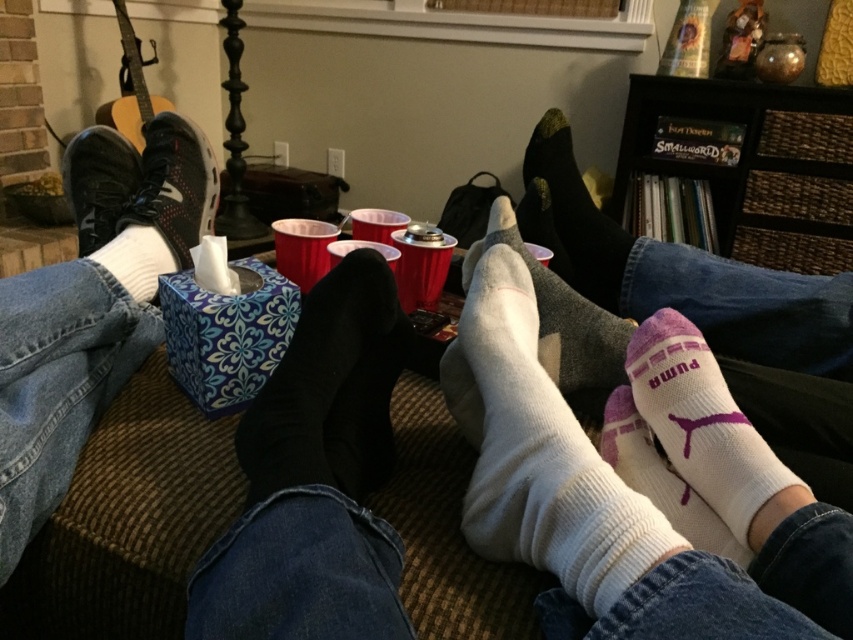
You are standing in the living room and see the point marked at coordinate (708, 429). What object is located at that point?

The point at coordinate (708, 429) indicates white cotton socks at lower right.

You are standing at the origin of the coordinate system in the living room. You see two points marked on the floor, point 1 at coordinates point (511, 291) and point 2 at coordinates point (724, 484). Which point is closer to you?

Point 2 at coordinates point (724, 484) is closer to you because it is in front of point 1 at coordinates point (511, 291).

You are organizing a game where players must place their feet on the floor without overlapping. You have two pairs of socks on the floor, the white ribbed sock at lower center and the white cotton socks at lower right. Which pair of socks has a wider base to stand on?

The white ribbed sock at lower center has a larger width than the white cotton socks at lower right, so it has a wider base to stand on.